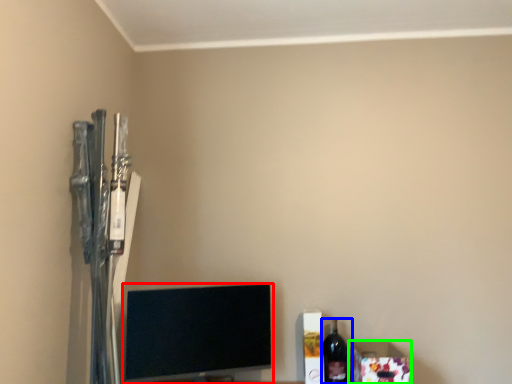
Question: Based on their relative distances, which object is farther from television (highlighted by a red box)? Choose from bottle (highlighted by a blue box) and box (highlighted by a green box).

Choices:
 (A) bottle
 (B) box

Answer: (B)